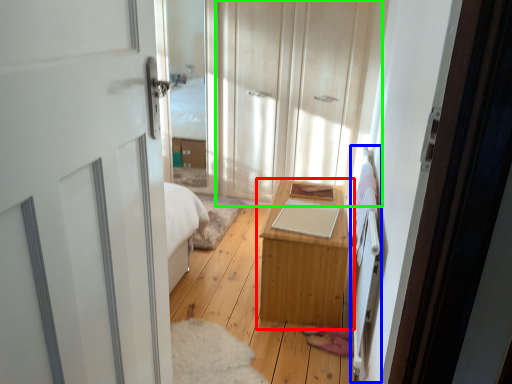
Question: Which object is the farthest from table (highlighted by a red box)? Choose among these: bed frame (highlighted by a blue box) or dresser (highlighted by a green box).

Choices:
 (A) bed frame
 (B) dresser

Answer: (B)